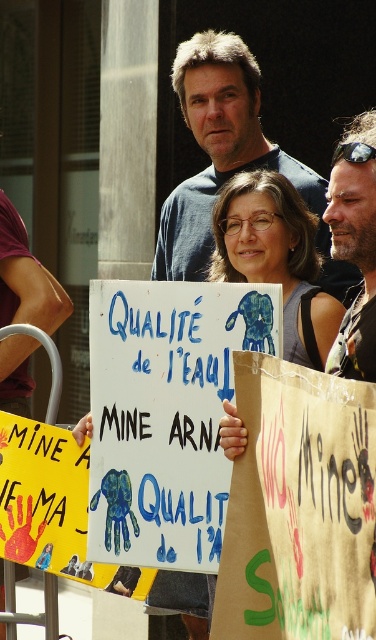
You are a photographer taking a picture of the protesters. You notice the blue cotton shirt at center and the matte blue sign at center. Which object is taller?

The blue cotton shirt at center is much taller than the matte blue sign at center.